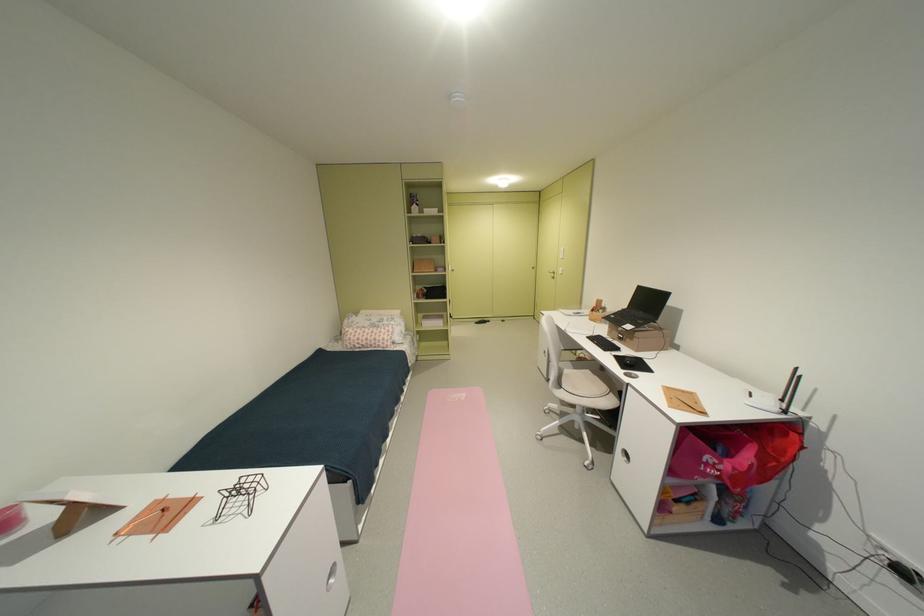
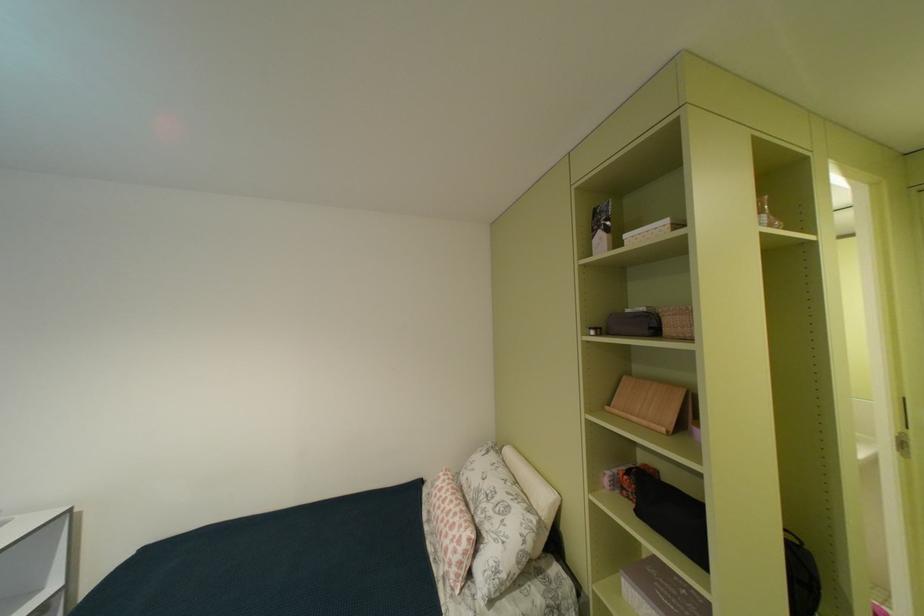
In the second image, find the point that corresponds to (446,211) in the first image.

(676, 223)